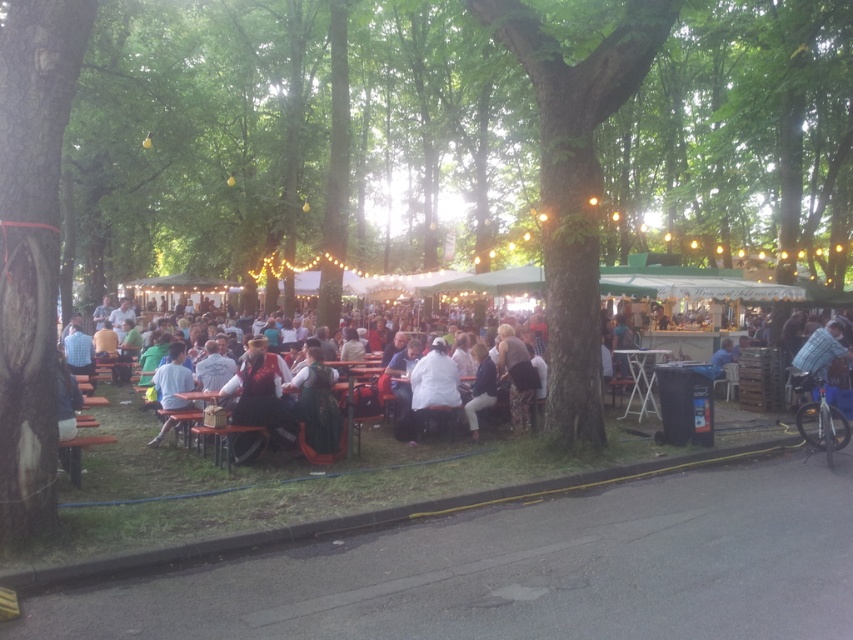
Question: Is green rough bark tree at left positioned at the back of light blue shirt at center?

Choices:
 (A) no
 (B) yes

Answer: (A)

Question: Which object appears farthest from the camera in this image?

Choices:
 (A) wooden chair at center
 (B) white plastic table at right

Answer: (B)

Question: Which object is closer to the camera taking this photo?

Choices:
 (A) wooden chair at center
 (B) green rough bark tree at left
 (C) white plastic table at right

Answer: (B)

Question: Which of the following is the closest to the observer?

Choices:
 (A) white plastic table at right
 (B) white matte coat at center

Answer: (B)

Question: Is green rough bark tree at center above light blue shirt at center?

Choices:
 (A) yes
 (B) no

Answer: (A)

Question: Is wooden chair at center behind white matte coat at center?

Choices:
 (A) yes
 (B) no

Answer: (B)